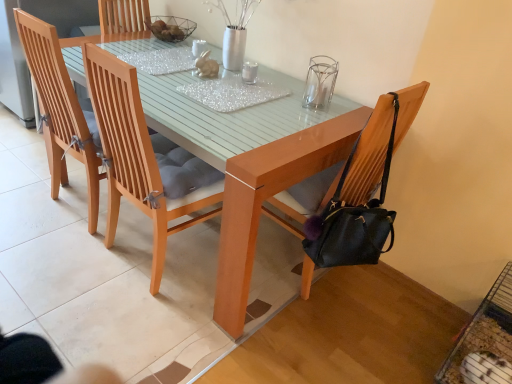
Question: Is light brown wooden chair at center, arranged as the 2th chair when viewed from the right, inside or outside of black leather chair at right, which appears as the fourth chair when viewed from the left?

Choices:
 (A) inside
 (B) outside

Answer: (B)

Question: From the image's perspective, is light brown wooden chair at center, which is counted as the third chair, starting from the left, located above or below black leather chair at right, placed as the first chair when sorted from right to left?

Choices:
 (A) below
 (B) above

Answer: (B)

Question: Based on their relative distances, which object is farther from the transparent glass candle holder at upper center?

Choices:
 (A) black leather chair at right, which appears as the fourth chair when viewed from the left
 (B) wooden chair at center, positioned as the second chair in left-to-right order
 (C) light brown wooden chair at center, arranged as the 2th chair when viewed from the right
 (D) light brown wood chair at upper left, which is the 4th chair in right-to-left order

Answer: (D)

Question: Which object is the closest to the light brown wood chair at upper left, which ranks as the first chair in left-to-right order?

Choices:
 (A) transparent glass candle holder at upper center
 (B) light brown wooden chair at center, which is counted as the third chair, starting from the left
 (C) wooden chair at center, positioned as the second chair in left-to-right order
 (D) black leather chair at right, which appears as the fourth chair when viewed from the left

Answer: (C)